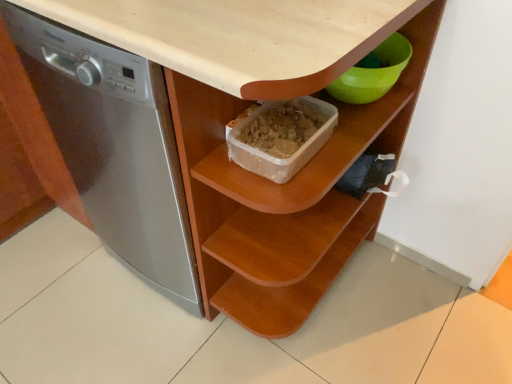
The height and width of the screenshot is (384, 512). Identify the location of vacant space situated on the left part of satin silver dishwasher at left. (52, 279).